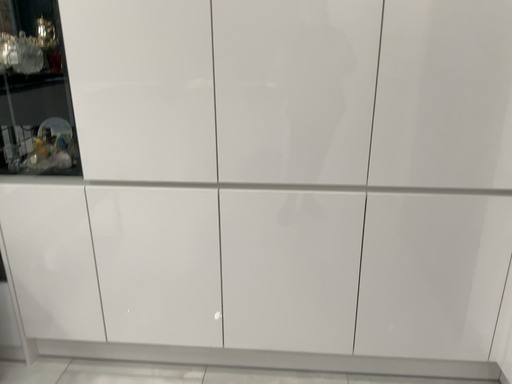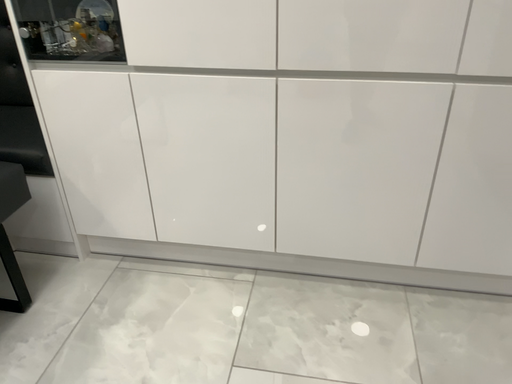
Question: Which way did the camera rotate in the video?

Choices:
 (A) rotated downward
 (B) rotated upward

Answer: (A)